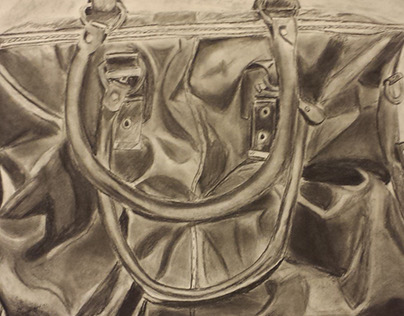
Image resolution: width=404 pixels, height=316 pixels. Find the location of `handle`. handle is located at coordinates (210, 211), (208, 292).